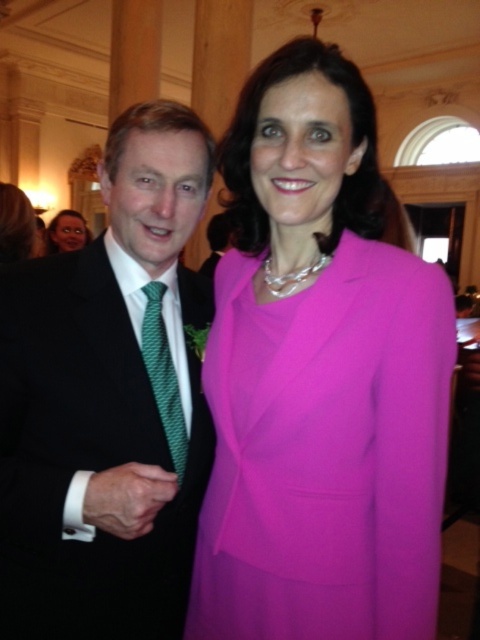
Based on the photo, can you confirm if matte pink suit at center is thinner than green textured tie at left?

No, matte pink suit at center is not thinner than green textured tie at left.

Does matte pink suit at center have a lesser height compared to green textured tie at left?

No, matte pink suit at center is not shorter than green textured tie at left.

Who is more distant from viewer, (268, 216) or (151, 348)?

The point (268, 216) is behind.

I want to click on matte pink suit at center, so click(320, 376).

Is matte black suit at left closer to camera compared to green textured tie at left?

Yes.

Is point (178, 474) positioned before point (158, 332)?

Yes, it is.

Identify the location of matte black suit at left. The image size is (480, 640). (108, 403).

Who is shorter, matte pink suit at center or matte black suit at left?

With less height is matte black suit at left.

Between matte pink suit at center and matte black suit at left, which one is positioned lower?

matte black suit at left is below.

Does point (287, 99) lie behind point (189, 157)?

No, (287, 99) is closer to viewer.

This screenshot has height=640, width=480. In order to click on matte pink suit at center in this screenshot , I will do `click(320, 376)`.